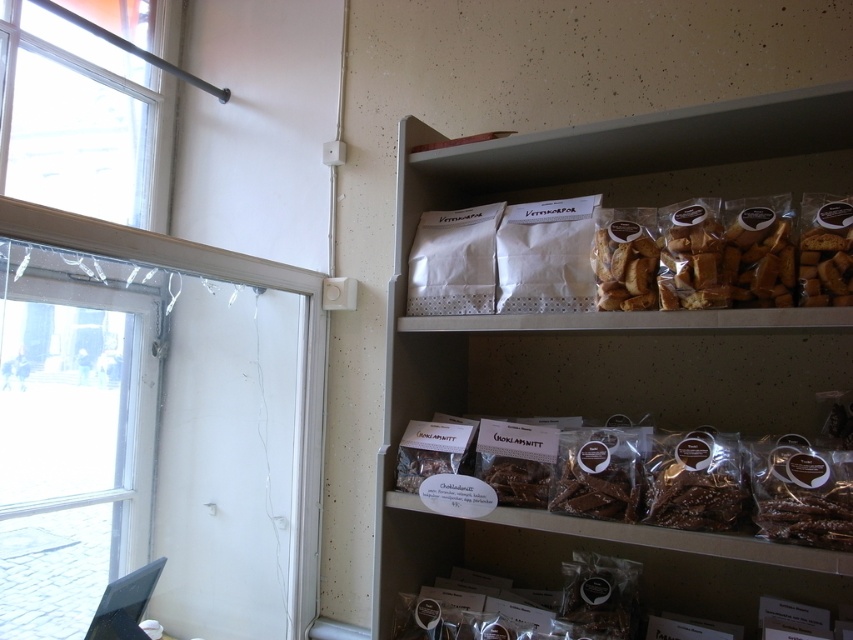
Question: Among these objects, which one is farthest from the camera?

Choices:
 (A) matte white shelf at upper right
 (B) clear glass window at upper left
 (C) clear glass window at left

Answer: (C)

Question: Does clear glass window at left have a smaller size compared to golden brown paper at upper right?

Choices:
 (A) yes
 (B) no

Answer: (B)

Question: Which of the following is the closest to the observer?

Choices:
 (A) (107, 339)
 (B) (602, 209)
 (C) (827, 451)

Answer: (C)

Question: Does matte white shelf at upper right have a greater width compared to golden brown paper at upper right?

Choices:
 (A) no
 (B) yes

Answer: (B)

Question: Can you confirm if clear glass window at upper left is positioned below golden brown paper at upper right?

Choices:
 (A) no
 (B) yes

Answer: (A)

Question: Which point appears farthest from the camera in this image?

Choices:
 (A) (817, 422)
 (B) (670, 240)
 (C) (691, 477)

Answer: (A)